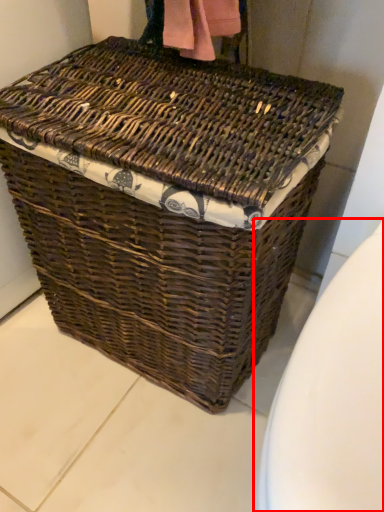
Question: Observing the image, what is the correct spatial positioning of toilet bowl (annotated by the red box) in reference to picnic basket?

Choices:
 (A) left
 (B) right

Answer: (B)